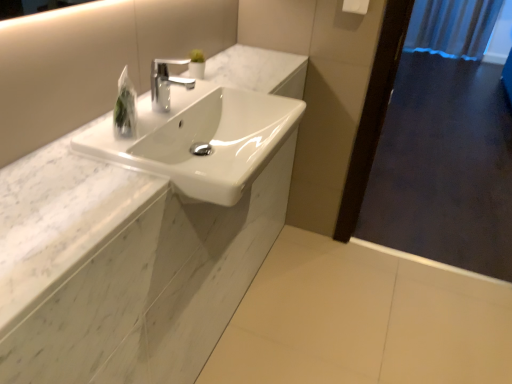
You are a GUI agent. You are given a task and a screenshot of the screen. Output one action in this format:
    pyautogui.click(x=<x>, y=<y>)
    Task: Click on the free space to the back side of polished chrome faucet at center
    The width and height of the screenshot is (512, 384).
    Given the screenshot: What is the action you would take?
    pyautogui.click(x=170, y=88)